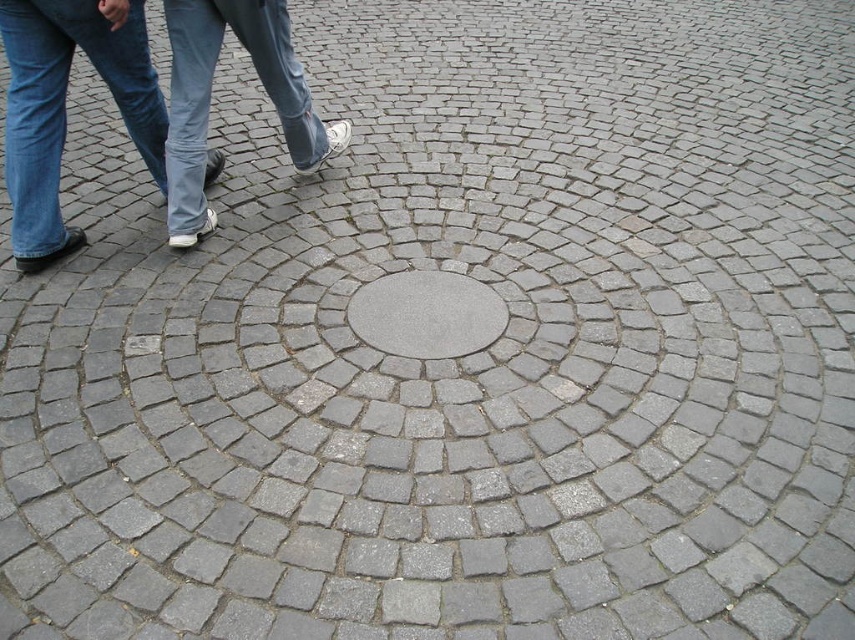
Does white canvas shoe at center have a greater width compared to gray concrete manhole cover at center?

Yes, white canvas shoe at center is wider than gray concrete manhole cover at center.

Is white canvas shoe at center taller than gray concrete manhole cover at center?

Correct, white canvas shoe at center is much taller as gray concrete manhole cover at center.

Does point (287, 138) come closer to viewer compared to point (387, 317)?

That is False.

Find the location of a particular element. Image resolution: width=855 pixels, height=640 pixels. white canvas shoe at center is located at coordinates (209, 97).

Is blue jeans at left above gray concrete manhole cover at center?

Yes.

Does blue jeans at left appear on the right side of gray concrete manhole cover at center?

Incorrect, blue jeans at left is not on the right side of gray concrete manhole cover at center.

Find the location of `blue jeans at left`. blue jeans at left is located at coordinates (65, 109).

The image size is (855, 640). I want to click on blue jeans at left, so click(x=65, y=109).

Who is taller, blue jeans at left or white canvas shoe at center?

blue jeans at left is taller.

How much distance is there between blue jeans at left and white canvas shoe at center?

A distance of 37.68 centimeters exists between blue jeans at left and white canvas shoe at center.

Which is behind, point (60, 154) or point (293, 132)?

The point (293, 132) is behind.

Find the location of a particular element. The image size is (855, 640). blue jeans at left is located at coordinates (65, 109).